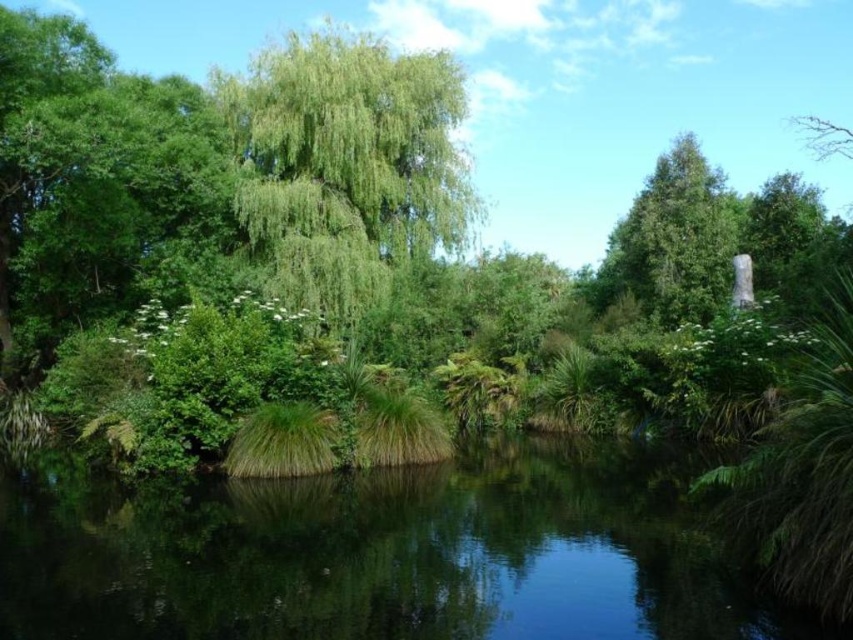
Can you confirm if green leafy tree at upper center is positioned above green matte tree at upper right?

Yes.

Which of these two, green leafy tree at upper center or green matte tree at upper right, stands shorter?

With less height is green matte tree at upper right.

You are a GUI agent. You are given a task and a screenshot of the screen. Output one action in this format:
    pyautogui.click(x=<x>, y=<y>)
    Task: Click on the green leafy tree at upper center
    This screenshot has width=853, height=640.
    Given the screenshot: What is the action you would take?
    pyautogui.click(x=345, y=166)

Does green grassy lake at center lie behind green leafy tree at upper center?

No, it is in front of green leafy tree at upper center.

Does green grassy lake at center have a lesser height compared to green leafy tree at upper center?

Indeed, green grassy lake at center has a lesser height compared to green leafy tree at upper center.

Who is more distant from viewer, (630, 566) or (442, 99)?

The point (442, 99) is behind.

The width and height of the screenshot is (853, 640). I want to click on green grassy lake at center, so click(376, 552).

Consider the image. Who is higher up, green grassy lake at center or green matte tree at upper right?

green matte tree at upper right

Does point (216, 580) come behind point (633, 198)?

No.

Does point (373, 556) come behind point (672, 241)?

No, (373, 556) is in front of (672, 241).

The image size is (853, 640). What are the coordinates of `green grassy lake at center` in the screenshot? It's located at (376, 552).